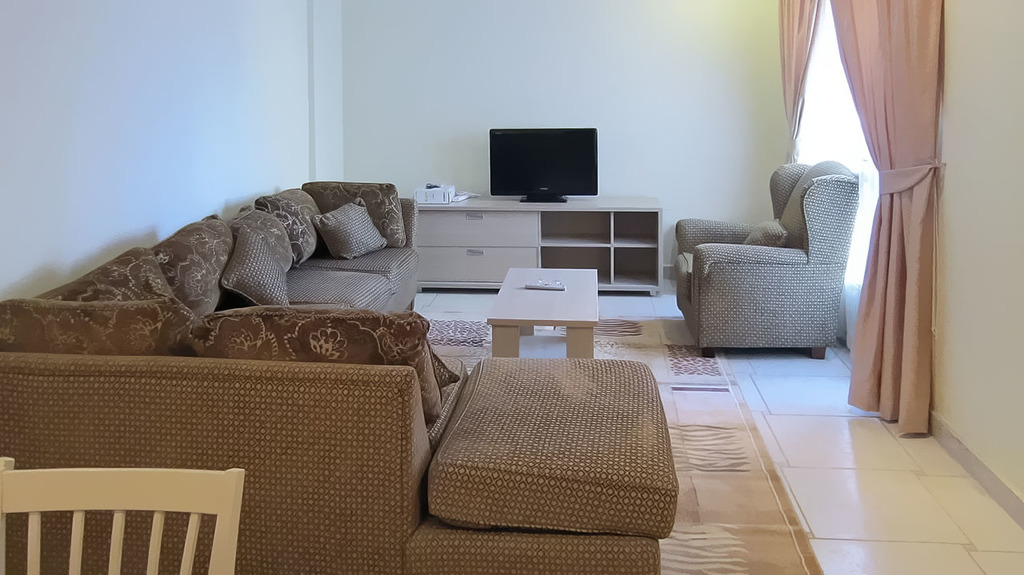
The height and width of the screenshot is (575, 1024). I want to click on pillows, so click(269, 263), click(341, 229).